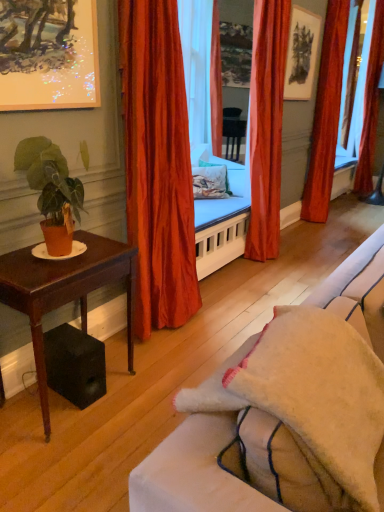
Locate an element on the screen. Image resolution: width=384 pixels, height=512 pixels. vacant region in front of mahogany wood side table at left is located at coordinates (x=64, y=457).